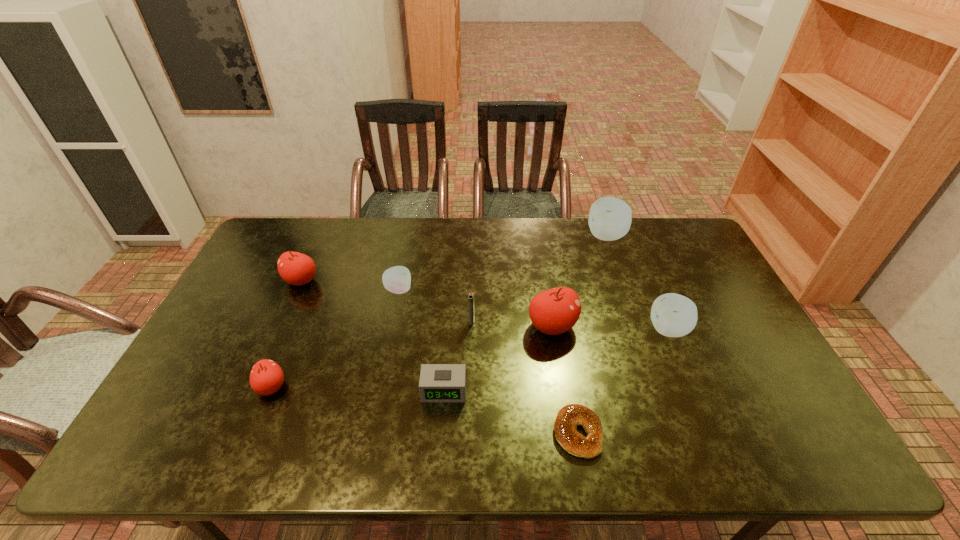
Locate an element on the screen. The image size is (960, 540). the farthest apple is located at coordinates (610, 218).

This screenshot has height=540, width=960. Identify the location of the farthest object. (610, 218).

Locate an element on the screen. The height and width of the screenshot is (540, 960). the second farthest red apple is located at coordinates (555, 311).

In order to click on the fourth apple from left to right in this screenshot , I will do `click(555, 311)`.

What are the coordinates of `the nearest white apple` in the screenshot? It's located at (673, 315).

The width and height of the screenshot is (960, 540). What are the coordinates of `the second smallest red apple` in the screenshot? It's located at (295, 268).

The image size is (960, 540). What are the coordinates of `igniter` in the screenshot? It's located at (471, 298).

Find the location of a particular element. the leftmost white apple is located at coordinates pos(397,279).

Image resolution: width=960 pixels, height=540 pixels. I want to click on the smallest white apple, so click(397, 279).

Locate an element on the screen. This screenshot has width=960, height=540. the nearest red apple is located at coordinates (266, 377).